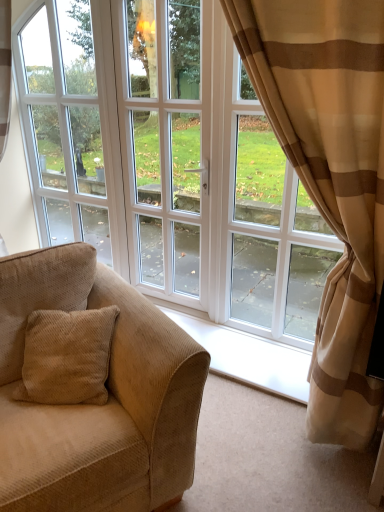
What is the approximate height of white glass window at center?

The height of white glass window at center is 5.83 feet.

Image resolution: width=384 pixels, height=512 pixels. What do you see at coordinates (66, 125) in the screenshot?
I see `white glass window at center` at bounding box center [66, 125].

Locate an element on the screen. This screenshot has width=384, height=512. beige corduroy couch at left is located at coordinates (93, 405).

The image size is (384, 512). Find the location of `beige striped curtain at right`. beige striped curtain at right is located at coordinates (330, 178).

Describe the element at coordinates (330, 178) in the screenshot. The image size is (384, 512). I see `beige striped curtain at right` at that location.

This screenshot has width=384, height=512. I want to click on white glass window at center, so click(x=66, y=125).

Considering the sizes of objects white glossy door at center and beige striped curtain at right in the image provided, who is wider, white glossy door at center or beige striped curtain at right?

Wider between the two is beige striped curtain at right.

At what (x,y) coordinates should I click in order to perform the action: click on curtain below the white glossy door at center (from the image's perspective). Please return your answer as a coordinate pair (x, y). This screenshot has height=512, width=384. Looking at the image, I should click on (330, 178).

Does point (187, 201) come closer to viewer compared to point (375, 156)?

That is False.

Is white glass window at center in contact with beige striped curtain at right?

They are not placed beside each other.

Can beige striped curtain at right be found inside white glass window at center?

That's incorrect, beige striped curtain at right is not inside white glass window at center.

Considering the relative positions of white glass window at center and beige striped curtain at right in the image provided, is white glass window at center to the left of beige striped curtain at right from the viewer's perspective?

Yes.

Based on the photo, from the image's perspective, who appears lower, white glass window at center or beige striped curtain at right?

beige striped curtain at right appears lower in the image.

Which is behind, point (363, 300) or point (59, 266)?

Positioned behind is point (59, 266).

Looking at this image, from the image's perspective, which is above, beige striped curtain at right or beige corduroy couch at left?

beige striped curtain at right is shown above in the image.

Is beige striped curtain at right next to beige corduroy couch at left?

beige striped curtain at right and beige corduroy couch at left are not in contact.

Considering the sizes of white glass window at center and white glossy door at center in the image, is white glass window at center taller or shorter than white glossy door at center?

Clearly, white glass window at center is shorter compared to white glossy door at center.

Could you tell me if white glass window at center is turned towards white glossy door at center?

No, white glass window at center does not turn towards white glossy door at center.

Considering the positions of objects white glass window at center and white glossy door at center in the image provided, who is in front, white glass window at center or white glossy door at center?

white glossy door at center is closer to the camera.

Does beige corduroy couch at left have a lesser width compared to white glass window at center?

In fact, beige corduroy couch at left might be wider than white glass window at center.

From the image's perspective, which object appears higher, beige corduroy couch at left or white glass window at center?

From the image's view, white glass window at center is above.

Considering the relative positions of beige corduroy couch at left and white glass window at center in the image provided, is beige corduroy couch at left to the right of white glass window at center from the viewer's perspective?

Yes, beige corduroy couch at left is to the right of white glass window at center.

Is white glass window at center oriented towards beige corduroy couch at left?

No, white glass window at center is not turned towards beige corduroy couch at left.

From the picture: From the image's perspective, which one is positioned higher, white glass window at center or beige corduroy couch at left?

From the image's view, white glass window at center is above.

Is white glass window at center wider or thinner than beige corduroy couch at left?

Clearly, white glass window at center has less width compared to beige corduroy couch at left.

From a real-world perspective, which object stands above the other?

In real-world perspective, beige striped curtain at right is above.

Is beige corduroy couch at left behind beige striped curtain at right?

→ No, beige corduroy couch at left is closer to the viewer.

Are beige corduroy couch at left and beige striped curtain at right located far from each other?

No, beige corduroy couch at left is not far away from beige striped curtain at right.

You are a GUI agent. You are given a task and a screenshot of the screen. Output one action in this format:
    pyautogui.click(x=<x>, y=<y>)
    Task: Click on the screen door above the beige striped curtain at right (from a real-world perspective)
    This screenshot has width=384, height=512.
    Given the screenshot: What is the action you would take?
    (166, 143)

At what (x,y) coordinates should I click in order to perform the action: click on window frame lying behind the beige striped curtain at right. Please return your answer as a coordinate pair (x, y). Looking at the image, I should click on (66, 125).

Based on their spatial positions, is white glossy door at center or white glass window at center further from beige striped curtain at right?

white glass window at center is further to beige striped curtain at right.

Which object lies further to the anchor point beige corduroy couch at left, white glass window at center or white glossy door at center?

white glass window at center is further to beige corduroy couch at left.

Which object lies nearer to the anchor point white glossy door at center, white glass window at center or beige striped curtain at right?

white glass window at center is closer to white glossy door at center.

Estimate the real-world distances between objects in this image. Which object is further from white glass window at center, white glossy door at center or beige corduroy couch at left?

beige corduroy couch at left.

Based on their spatial positions, is beige striped curtain at right or white glass window at center further from white glossy door at center?

Among the two, beige striped curtain at right is located further to white glossy door at center.

When comparing their distances from beige striped curtain at right, does beige corduroy couch at left or white glossy door at center seem closer?

Based on the image, beige corduroy couch at left appears to be nearer to beige striped curtain at right.

Estimate the real-world distances between objects in this image. Which object is closer to beige corduroy couch at left, beige striped curtain at right or white glass window at center?

beige striped curtain at right.

Looking at the image, which one is located further to white glossy door at center, beige corduroy couch at left or beige striped curtain at right?

beige corduroy couch at left is positioned further to the anchor white glossy door at center.

Where is `screen door positioned between beige corduroy couch at left and white glass window at center from near to far`? screen door positioned between beige corduroy couch at left and white glass window at center from near to far is located at coordinates (166, 143).

The width and height of the screenshot is (384, 512). What are the coordinates of `screen door positioned between beige striped curtain at right and white glass window at center from near to far` in the screenshot? It's located at [x=166, y=143].

Where is `curtain between beige corduroy couch at left and white glass window at center from front to back`? curtain between beige corduroy couch at left and white glass window at center from front to back is located at coordinates (330, 178).

The image size is (384, 512). In order to click on curtain positioned between beige corduroy couch at left and white glossy door at center from near to far in this screenshot , I will do `click(330, 178)`.